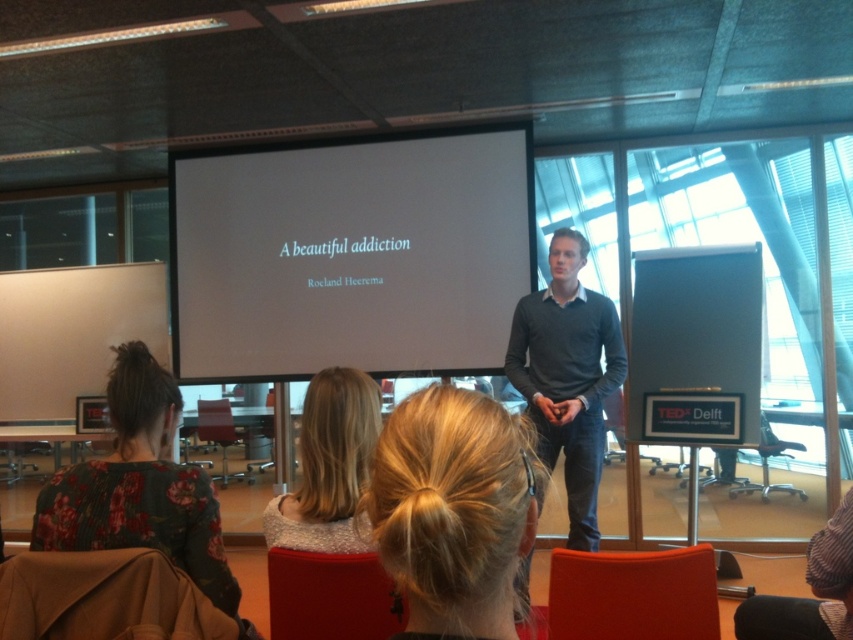
Does blonde hair bun at center have a larger size compared to blonde hair at center?

No.

Can you confirm if blonde hair bun at center is taller than blonde hair at center?

No, blonde hair bun at center is not taller than blonde hair at center.

Where is `blonde hair bun at center`? Image resolution: width=853 pixels, height=640 pixels. blonde hair bun at center is located at coordinates (453, 509).

Find the location of a particular element. Image resolution: width=853 pixels, height=640 pixels. blonde hair bun at center is located at coordinates (453, 509).

Does dark gray sweater at center have a greater width compared to black plastic chair at center?

Correct, the width of dark gray sweater at center exceeds that of black plastic chair at center.

The width and height of the screenshot is (853, 640). What are the coordinates of `dark gray sweater at center` in the screenshot? It's located at (567, 376).

Image resolution: width=853 pixels, height=640 pixels. Find the location of `dark gray sweater at center`. dark gray sweater at center is located at coordinates (567, 376).

Between point (477, 596) and point (213, 625), which one is positioned behind?

The point (213, 625) is behind.

Which of these two, blonde hair bun at center or brown fabric chair at lower left, stands taller?

blonde hair bun at center

Who is more distant from viewer, (440,628) or (32,593)?

The point (32,593) is behind.

Locate an element on the screen. Image resolution: width=853 pixels, height=640 pixels. blonde hair bun at center is located at coordinates (453, 509).